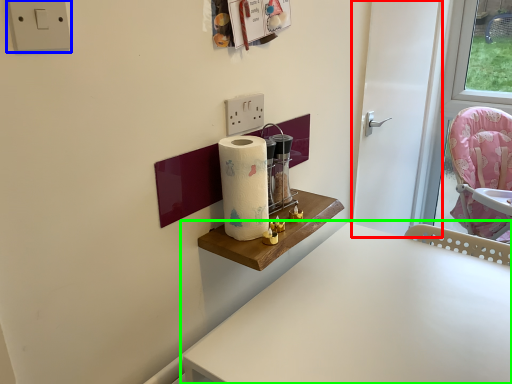
Question: Considering the real-world distances, which object is farthest from door (highlighted by a red box)? electric outlet (highlighted by a blue box) or table (highlighted by a green box)?

Choices:
 (A) electric outlet
 (B) table

Answer: (A)